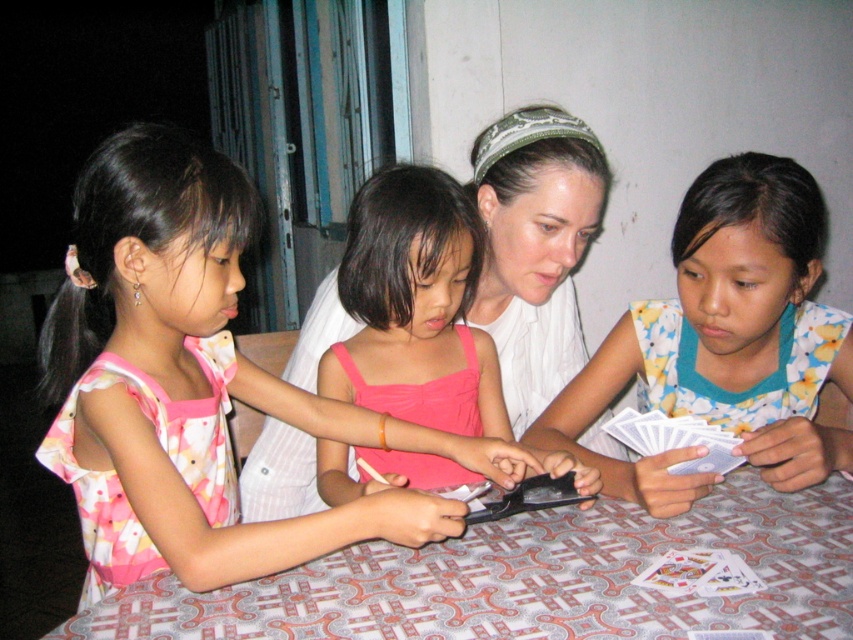
Can you confirm if pink fabric dress at left is taller than patterned fabric table at center?

Correct, pink fabric dress at left is much taller as patterned fabric table at center.

Image resolution: width=853 pixels, height=640 pixels. I want to click on pink fabric dress at left, so click(196, 385).

Is point (776, 624) farther from camera compared to point (469, 355)?

That is False.

Measure the distance between patterned fabric table at center and camera.

They are 30.51 inches apart.

Who is more forward, (x=782, y=532) or (x=460, y=362)?

Point (x=782, y=532) is more forward.

Identify the location of patterned fabric table at center. The width and height of the screenshot is (853, 640). (532, 579).

In the scene shown: Which of these two, white fabric at center or white paper cards at lower right, stands shorter?

Standing shorter between the two is white paper cards at lower right.

Does white fabric at center come behind white paper cards at lower right?

Yes, white fabric at center is behind white paper cards at lower right.

Locate an element on the screen. This screenshot has width=853, height=640. white fabric at center is located at coordinates (535, 248).